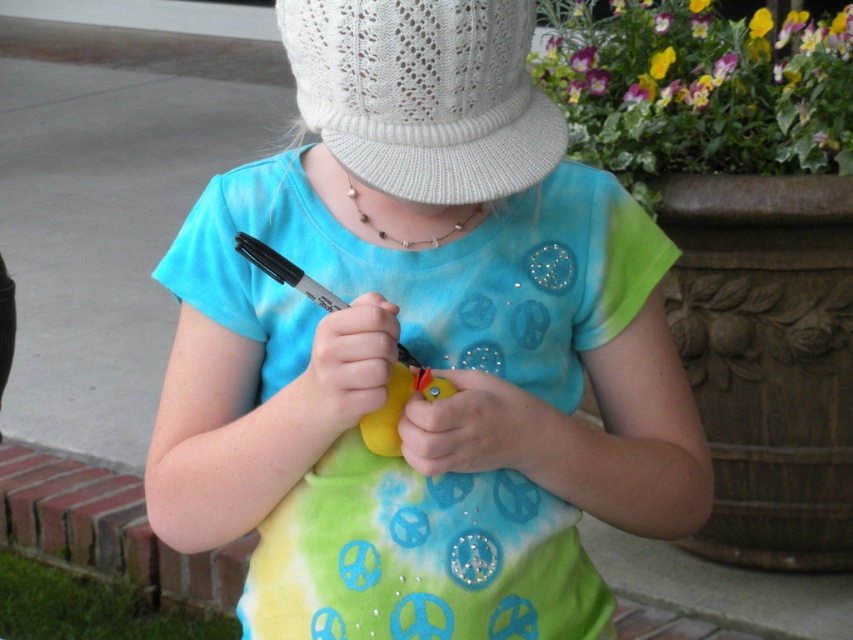
Does matte plastic rubber duck at center have a smaller size compared to white knitted hat at center?

No.

The width and height of the screenshot is (853, 640). What do you see at coordinates (421, 346) in the screenshot? I see `matte plastic rubber duck at center` at bounding box center [421, 346].

Which is behind, point (560, 400) or point (463, 189)?

Point (560, 400)

The width and height of the screenshot is (853, 640). What are the coordinates of `matte plastic rubber duck at center` in the screenshot? It's located at (421, 346).